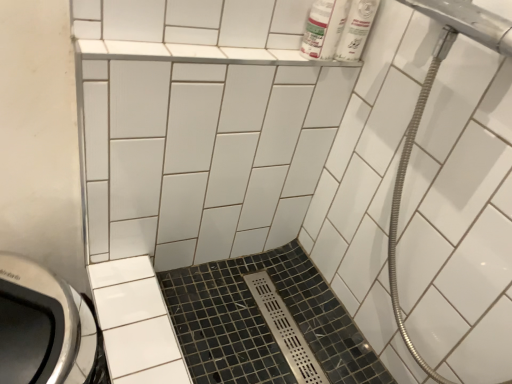
Question: Is metallic silver showerhead at upper right wider than white plastic bottles at upper right?

Choices:
 (A) yes
 (B) no

Answer: (A)

Question: Is metallic silver showerhead at upper right aimed at white plastic bottles at upper right?

Choices:
 (A) yes
 (B) no

Answer: (B)

Question: Does metallic silver showerhead at upper right appear on the left side of white plastic bottles at upper right?

Choices:
 (A) no
 (B) yes

Answer: (A)

Question: Are metallic silver showerhead at upper right and white plastic bottles at upper right beside each other?

Choices:
 (A) no
 (B) yes

Answer: (A)

Question: Is the position of metallic silver showerhead at upper right more distant than that of white plastic bottles at upper right?

Choices:
 (A) no
 (B) yes

Answer: (A)

Question: Is metallic silver showerhead at upper right taller or shorter than black mosaic tile at center, arranged as the 1th ceramic tile when ordered from the bottom?

Choices:
 (A) short
 (B) tall

Answer: (B)

Question: In the image, is metallic silver showerhead at upper right positioned in front of or behind black mosaic tile at center, marked as the second ceramic tile in a top-to-bottom arrangement?

Choices:
 (A) front
 (B) behind

Answer: (A)

Question: Is metallic silver showerhead at upper right wider or thinner than black mosaic tile at center, arranged as the 1th ceramic tile when ordered from the bottom?

Choices:
 (A) thin
 (B) wide

Answer: (A)

Question: Is metallic silver showerhead at upper right inside the boundaries of black mosaic tile at center, marked as the second ceramic tile in a top-to-bottom arrangement, or outside?

Choices:
 (A) outside
 (B) inside

Answer: (A)

Question: Based on their positions, is metallic silver showerhead at upper right located to the left or right of white glossy ceramic tile at upper center, marked as the first ceramic tile in a top-to-bottom arrangement?

Choices:
 (A) left
 (B) right

Answer: (B)

Question: Looking at their shapes, would you say metallic silver showerhead at upper right is wider or thinner than white glossy ceramic tile at upper center, marked as the first ceramic tile in a top-to-bottom arrangement?

Choices:
 (A) thin
 (B) wide

Answer: (B)

Question: Is metallic silver showerhead at upper right bigger or smaller than white glossy ceramic tile at upper center, which is the second ceramic tile from bottom to top?

Choices:
 (A) big
 (B) small

Answer: (A)

Question: From a real-world perspective, is metallic silver showerhead at upper right physically located above or below white glossy ceramic tile at upper center, marked as the first ceramic tile in a top-to-bottom arrangement?

Choices:
 (A) above
 (B) below

Answer: (A)

Question: Based on their sizes in the image, would you say white plastic bottles at upper right is bigger or smaller than metallic silver showerhead at upper right?

Choices:
 (A) small
 (B) big

Answer: (A)

Question: Considering the relative positions of white plastic bottles at upper right and metallic silver showerhead at upper right in the image provided, is white plastic bottles at upper right to the left or to the right of metallic silver showerhead at upper right?

Choices:
 (A) right
 (B) left

Answer: (B)